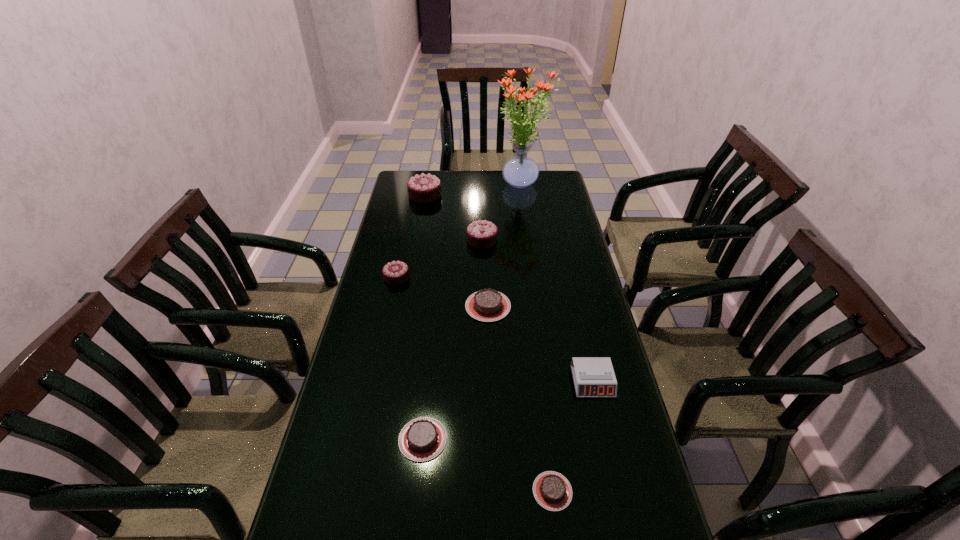
This screenshot has height=540, width=960. Identify the location of the tallest object. (520, 171).

This screenshot has width=960, height=540. Identify the location of flower arrangement. (520, 171).

This screenshot has width=960, height=540. Find the location of `the biggest chocolate chocolate cake`. the biggest chocolate chocolate cake is located at coordinates pos(425,188).

At what (x,y) coordinates should I click in order to perform the action: click on the seventh shortest object. Please return your answer as a coordinate pair (x, y). This screenshot has width=960, height=540. Looking at the image, I should click on (425, 188).

Where is `the second tallest chocolate cake`? Image resolution: width=960 pixels, height=540 pixels. the second tallest chocolate cake is located at coordinates (480, 234).

Identify the location of the second nearest chocolate chocolate cake. (480, 234).

Image resolution: width=960 pixels, height=540 pixels. Identify the location of the fourth shortest chocolate cake. (396, 272).

This screenshot has height=540, width=960. Identify the location of the fifth shortest object. (396, 272).

In order to click on the third nearest object in this screenshot , I will do `click(593, 376)`.

This screenshot has width=960, height=540. Find the location of `the fifth farthest object`. the fifth farthest object is located at coordinates (488, 305).